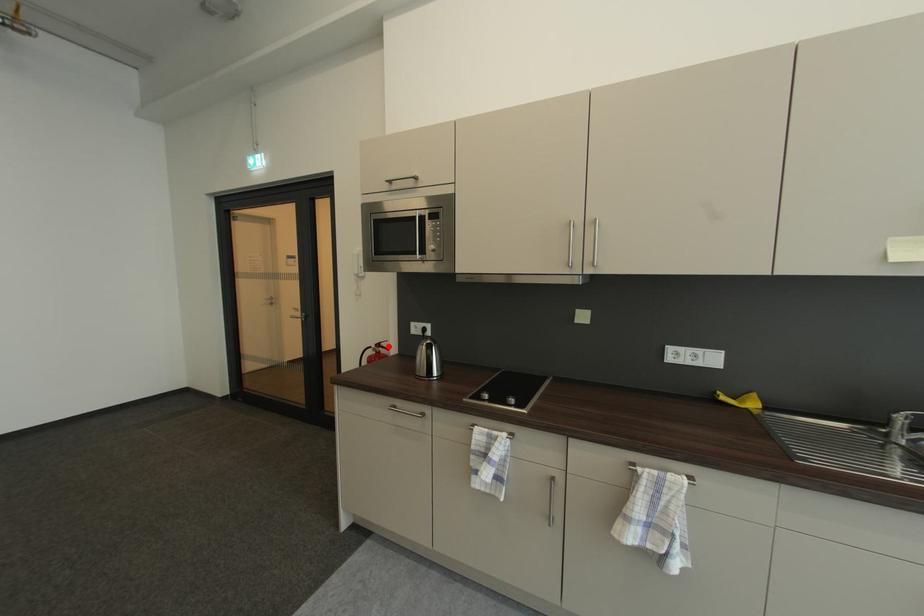
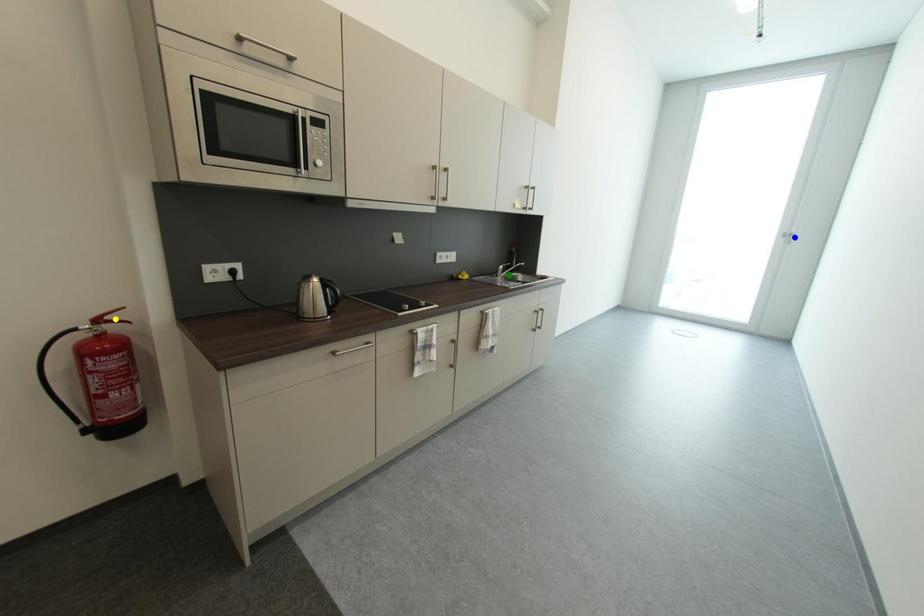
Question: I am providing you with two images of the same scene from different viewpoints. A red point is marked on the first image. You are given multiple points on the second image. Which spot in image 2 lines up with the point in image 1?

Choices:
 (A) yellow point
 (B) green point
 (C) blue point

Answer: (A)